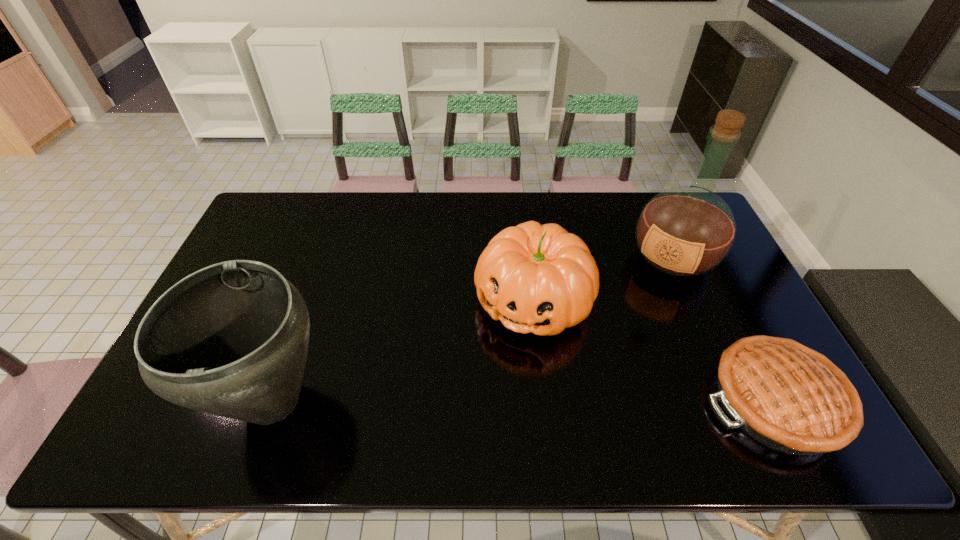
Where is `vacant area situated on the front label of the tallest object`? The width and height of the screenshot is (960, 540). vacant area situated on the front label of the tallest object is located at coordinates (619, 344).

Locate an element on the screen. free location located on the carved face of the third tallest object is located at coordinates (484, 387).

Where is `free point located 0.170m on the carved face of the third tallest object`? Image resolution: width=960 pixels, height=540 pixels. free point located 0.170m on the carved face of the third tallest object is located at coordinates coord(480,394).

Locate an element on the screen. The width and height of the screenshot is (960, 540). free region located 0.100m on the carved face of the third tallest object is located at coordinates (492, 372).

Locate an element on the screen. This screenshot has height=540, width=960. object located at the far edge is located at coordinates (685, 231).

Locate an element on the screen. This screenshot has height=540, width=960. urn situated at the near edge is located at coordinates (231, 339).

Identify the location of pie situated at the near edge. (791, 398).

Locate an element on the screen. object present at the left edge is located at coordinates (231, 339).

At what (x,y) coordinates should I click in order to perform the action: click on pie at the right edge. Please return your answer as a coordinate pair (x, y). Looking at the image, I should click on (791, 398).

I want to click on liquor that is positioned at the right edge, so pyautogui.click(x=685, y=231).